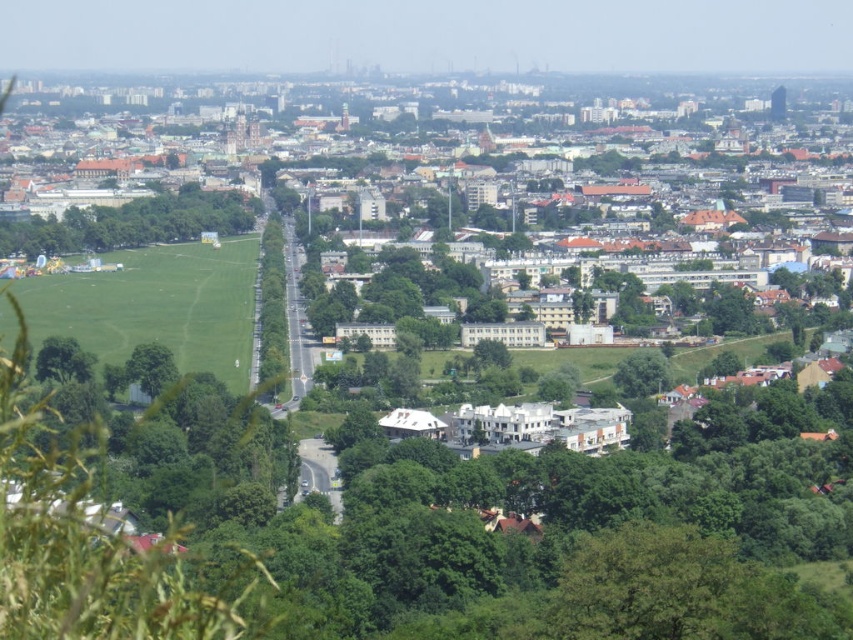
Is the position of green grass field at lower left less distant than that of green leafy tree at center?

That is True.

Is point (106, 355) farther from camera compared to point (286, 365)?

That is True.

Locate an element on the screen. The height and width of the screenshot is (640, 853). green grass field at lower left is located at coordinates (669, 269).

This screenshot has width=853, height=640. I want to click on green grass field at lower left, so click(669, 269).

Can you confirm if green grass field at lower left is smaller than green leafy tree at lower right?

No, green grass field at lower left is not smaller than green leafy tree at lower right.

Who is taller, green grass field at lower left or green leafy tree at lower right?

Standing taller between the two is green grass field at lower left.

What do you see at coordinates (669, 269) in the screenshot? I see `green grass field at lower left` at bounding box center [669, 269].

Where is `green grass field at lower left`? This screenshot has height=640, width=853. green grass field at lower left is located at coordinates (669, 269).

Consider the image. Can you confirm if green leafy tree at left is smaller than green leafy tree at center?

Actually, green leafy tree at left might be larger than green leafy tree at center.

Can you confirm if green leafy tree at left is positioned to the left of green leafy tree at center?

Yes, green leafy tree at left is to the left of green leafy tree at center.

Between point (6, 256) and point (260, 323), which one is positioned in front?

Point (260, 323) is in front.

Identify the location of green leafy tree at left. (131, 224).